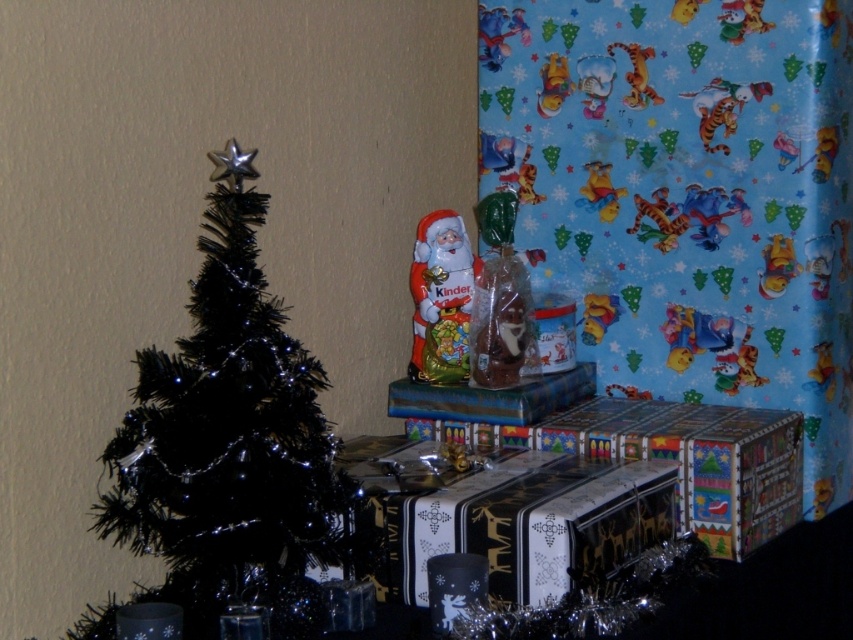
Based on the photo, is black artificial tree at left to the left of matte plastic santa at center from the viewer's perspective?

Indeed, black artificial tree at left is positioned on the left side of matte plastic santa at center.

Can you confirm if black artificial tree at left is smaller than matte plastic santa at center?

Actually, black artificial tree at left might be larger than matte plastic santa at center.

Find the location of `black artificial tree at left`. black artificial tree at left is located at coordinates (233, 445).

Can you confirm if black artificial tree at left is positioned above matte yellow plush bear at upper center?

No, black artificial tree at left is not above matte yellow plush bear at upper center.

Is point (291, 545) positioned before point (618, 205)?

Yes, it is.

You are a GUI agent. You are given a task and a screenshot of the screen. Output one action in this format:
    pyautogui.click(x=<x>, y=<y>)
    Task: Click on the black artificial tree at left
    The height and width of the screenshot is (640, 853).
    Given the screenshot: What is the action you would take?
    pyautogui.click(x=233, y=445)

Is black matte gift at center shorter than matte plastic santa at center?

Yes.

Who is lower down, black matte gift at center or matte plastic santa at center?

Positioned lower is black matte gift at center.

Is point (445, 524) in front of point (440, 244)?

Yes, it is.

The height and width of the screenshot is (640, 853). I want to click on black matte gift at center, so click(x=508, y=516).